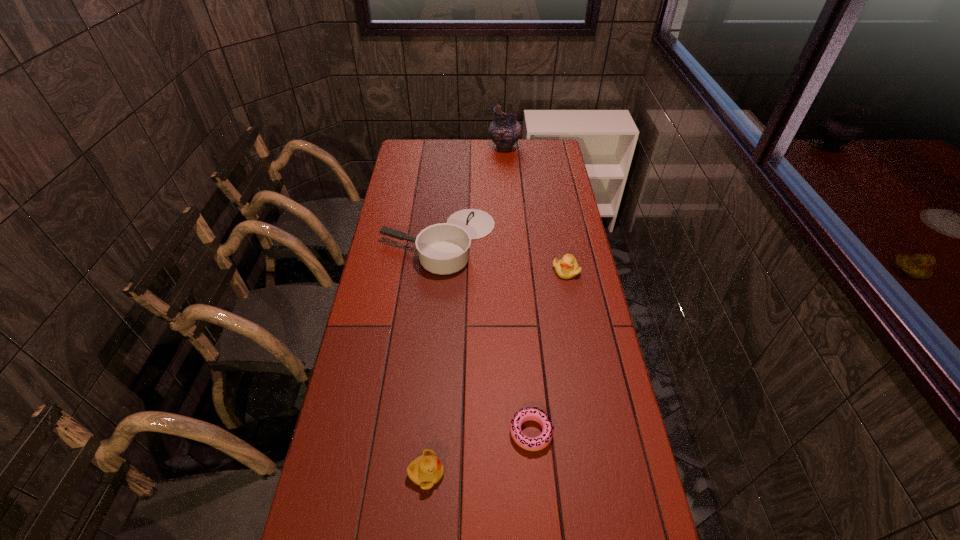
You are a GUI agent. You are given a task and a screenshot of the screen. Output one action in this format:
    pyautogui.click(x=<x>, y=<y>)
    Task: Click on the free space at the far left corner
    
    Given the screenshot: What is the action you would take?
    pyautogui.click(x=404, y=148)

Where is `vacant area that lies between the right duckling and the nearer duckling`? This screenshot has width=960, height=540. vacant area that lies between the right duckling and the nearer duckling is located at coordinates (496, 372).

This screenshot has width=960, height=540. In order to click on unoccupied area between the right duckling and the saucepan in this screenshot , I will do `click(502, 255)`.

Identify the location of empty space between the tallest object and the fourth farthest object. Image resolution: width=960 pixels, height=540 pixels. (517, 290).

I want to click on vacant area between the saucepan and the farther duckling, so click(502, 255).

Where is `free space between the saucepan and the nearest object`? The height and width of the screenshot is (540, 960). free space between the saucepan and the nearest object is located at coordinates (432, 357).

Locate an element on the screen. object that is the fourth closest to the doughnut is located at coordinates (505, 130).

Select which object is the closest to the right duckling. Please provide its 2D coordinates. Your answer should be formatted as a tuple, i.e. [(x, y)], where the tuple contains the x and y coordinates of a point satisfying the conditions above.

[(444, 248)]

Where is `free space that satisfies the following two spatial constraints: 1. on the front-facing side of the rightmost object; 2. at the beak of the nearest object`? Image resolution: width=960 pixels, height=540 pixels. free space that satisfies the following two spatial constraints: 1. on the front-facing side of the rightmost object; 2. at the beak of the nearest object is located at coordinates (605, 473).

The height and width of the screenshot is (540, 960). I want to click on vacant space that satisfies the following two spatial constraints: 1. on the back side of the saucepan; 2. on the left side of the tallest object, so click(x=447, y=147).